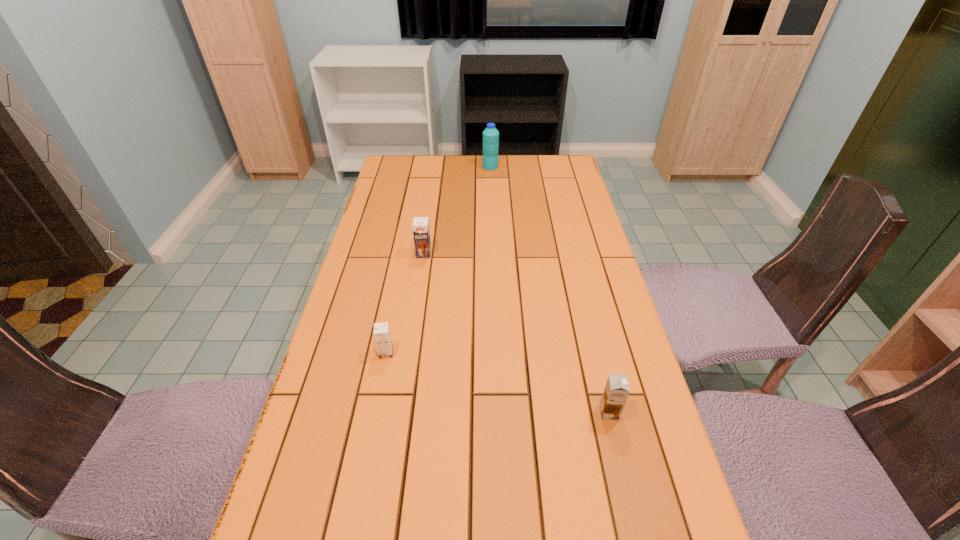
Locate an element on the screen. The image size is (960, 540). vacant area that lies between the farthest object and the shortest object is located at coordinates (439, 260).

You are a GUI agent. You are given a task and a screenshot of the screen. Output one action in this format:
    pyautogui.click(x=<x>, y=<y>)
    Task: Click on the free space between the shortest chocolate milk and the third object from left to right
    The width and height of the screenshot is (960, 540).
    Given the screenshot: What is the action you would take?
    pyautogui.click(x=439, y=260)

The image size is (960, 540). Identify the location of vacant area that lies between the water bottle and the rightmost object. (550, 290).

Where is `free space between the second object from right to left and the third nearest object`? This screenshot has width=960, height=540. free space between the second object from right to left and the third nearest object is located at coordinates (457, 210).

At what (x,y) coordinates should I click in order to perform the action: click on empty space that is in between the shortest chocolate milk and the tallest object. Please return your answer as a coordinate pair (x, y). Looking at the image, I should click on (439, 260).

Where is `vacant area that lies between the farthest chocolate milk and the farthest object`? This screenshot has height=540, width=960. vacant area that lies between the farthest chocolate milk and the farthest object is located at coordinates (457, 210).

Where is `vacant space in between the second farthest object and the rightmost object`? vacant space in between the second farthest object and the rightmost object is located at coordinates pyautogui.click(x=516, y=333).

Identify the location of free spot between the second chocolate milk from right to left and the rightmost chocolate milk. [x=516, y=333].

You are a GUI agent. You are given a task and a screenshot of the screen. Output one action in this format:
    pyautogui.click(x=<x>, y=<y>)
    Task: Click on the unoccupied position between the second nearest object and the third object from left to right
    This screenshot has width=960, height=540.
    Given the screenshot: What is the action you would take?
    tap(439, 260)

Identify the location of vacant area between the second farthest chocolate milk and the nearest chocolate milk. The image size is (960, 540). (497, 383).